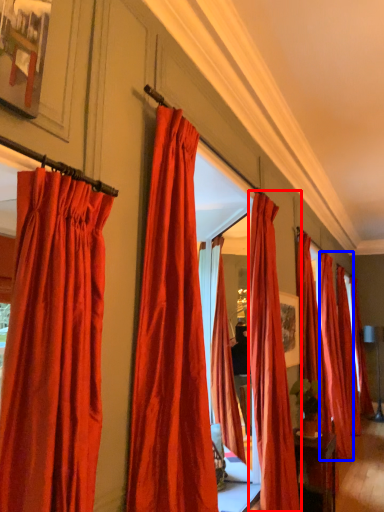
Question: Which object is further to the camera taking this photo, curtain (highlighted by a red box) or curtain (highlighted by a blue box)?

Choices:
 (A) curtain
 (B) curtain

Answer: (B)